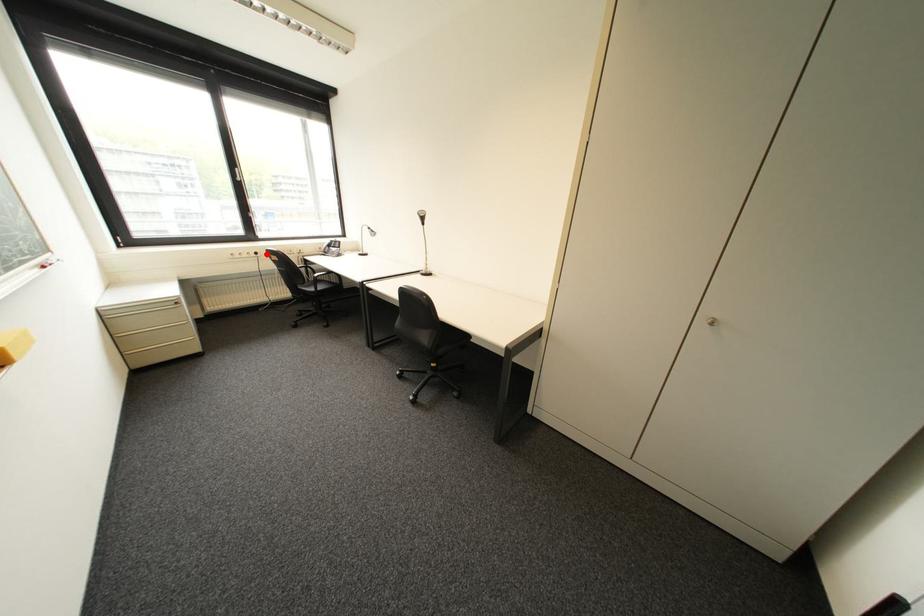
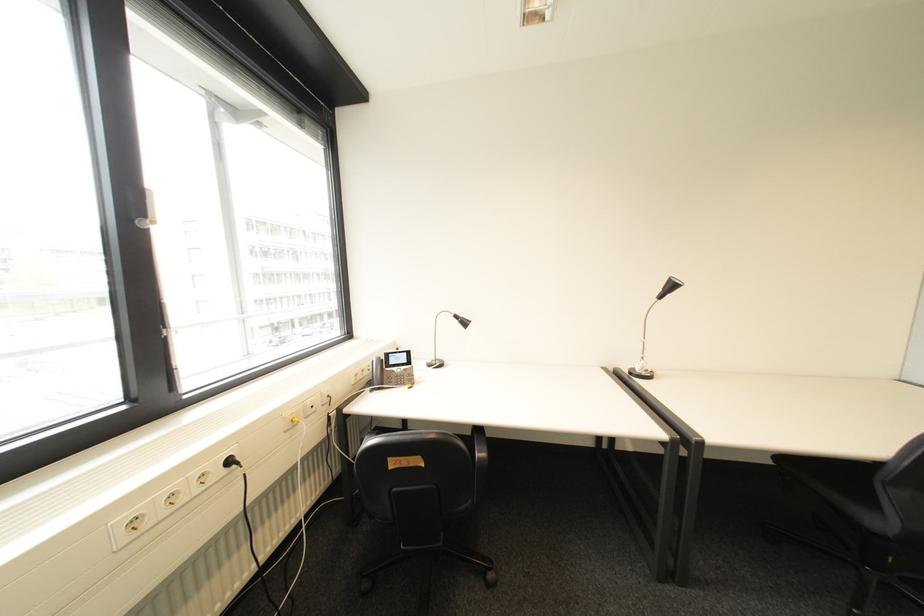
Locate, in the second image, the point that corresponds to the highlighted location in the first image.

(239, 463)